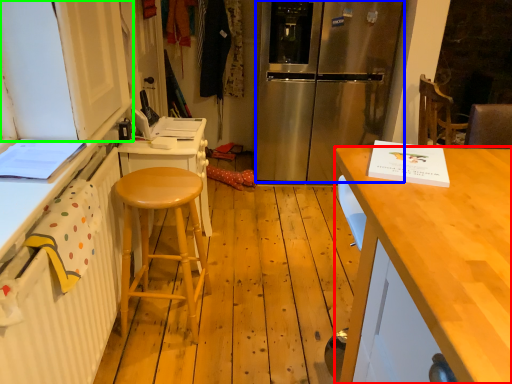
Question: Which object is positioned closest to desk (highlighted by a red box)? Select from refrigerator (highlighted by a blue box) and cabinetry (highlighted by a green box).

Choices:
 (A) refrigerator
 (B) cabinetry

Answer: (B)